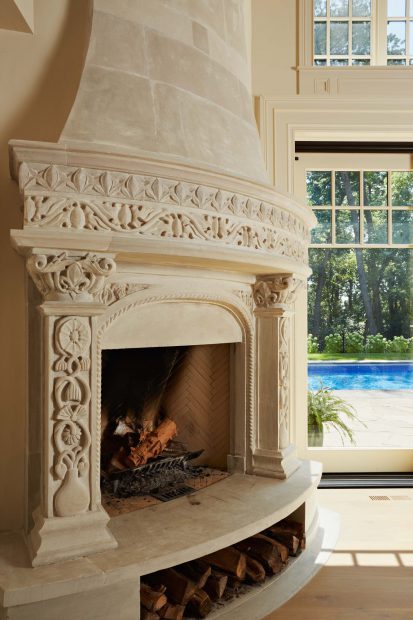
Locate an element on the screen. Image resolution: width=413 pixels, height=620 pixels. inside fireplace is located at coordinates (120, 371), (192, 384), (201, 430), (118, 471).